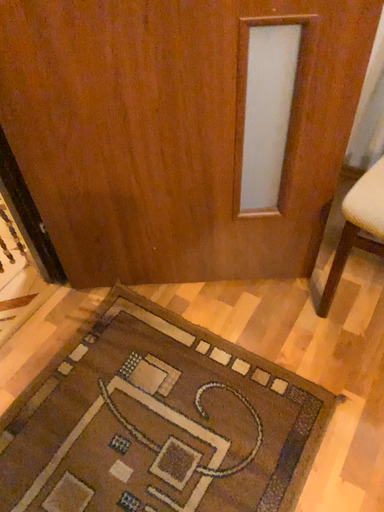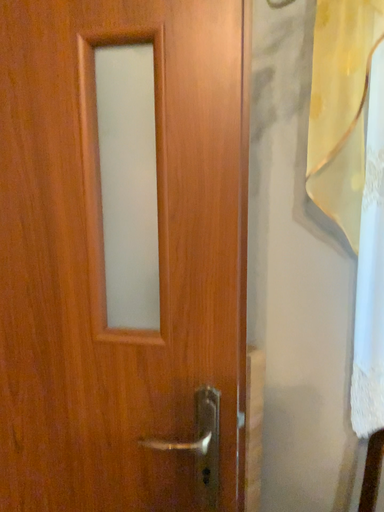
Question: Which way did the camera rotate in the video?

Choices:
 (A) rotated left
 (B) rotated right

Answer: (A)